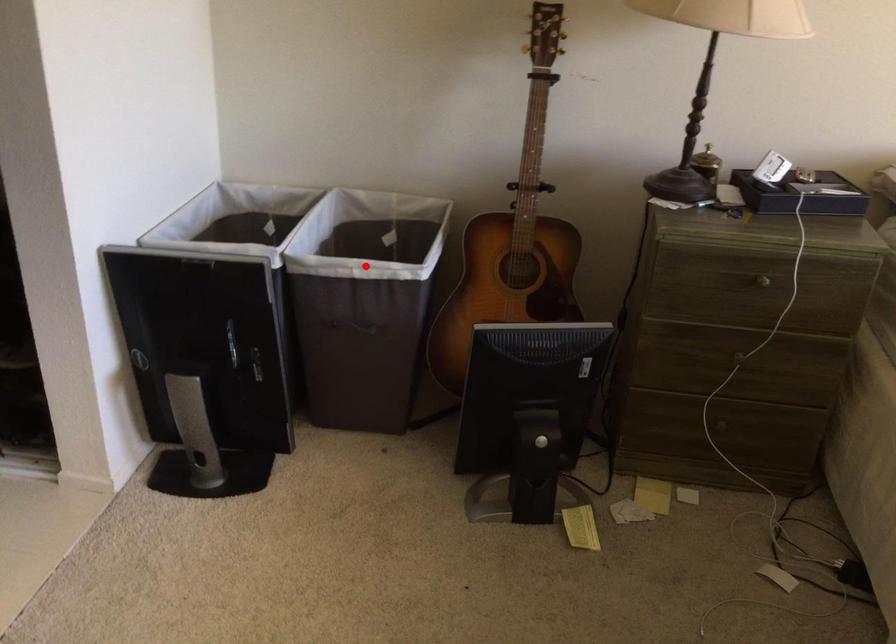
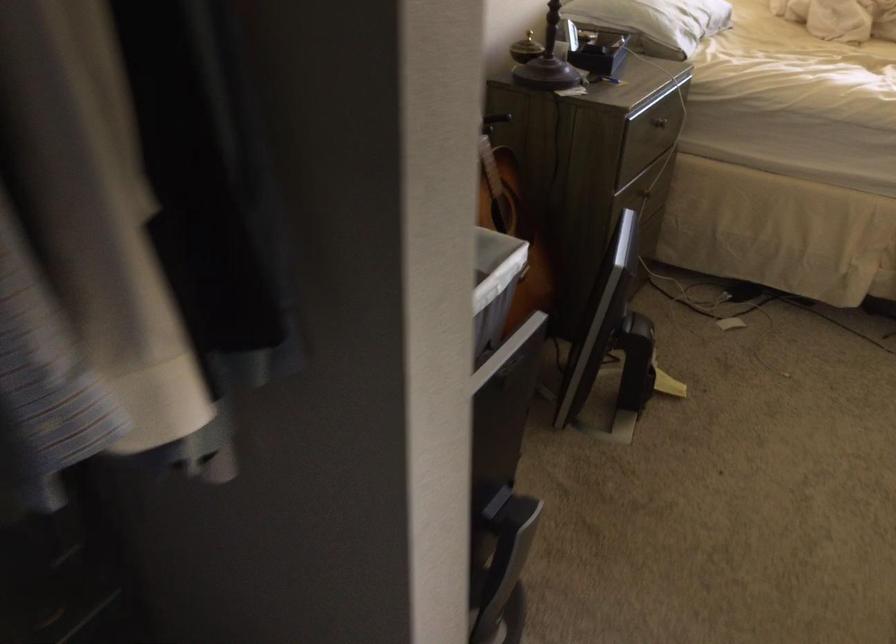
Question: I am providing you with two images of the same scene from different viewpoints. Given a red point in image1, look at the same physical point in image2. Is it:

Choices:
 (A) Closer to the viewpoint
 (B) Farther from the viewpoint

Answer: (A)